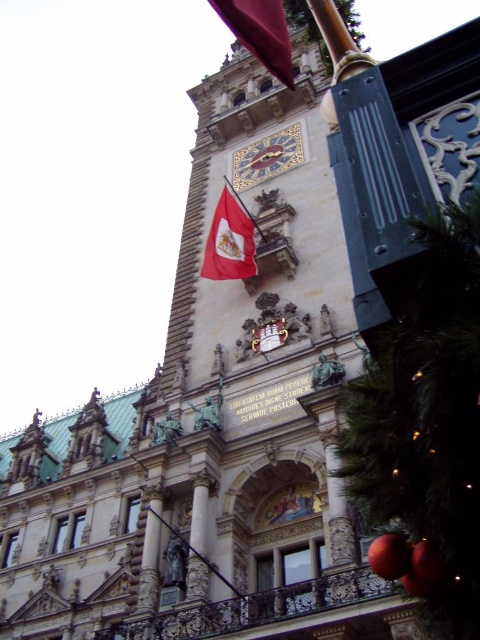
Does point (241, 237) come closer to viewer compared to point (241, 176)?

Yes, point (241, 237) is in front of point (241, 176).

Is red fabric flag at center bigger than gold mosaic clock at center?

Indeed, red fabric flag at center has a larger size compared to gold mosaic clock at center.

Is point (224, 205) farther from camera compared to point (278, 150)?

No.

The image size is (480, 640). Identify the location of red fabric flag at center. (229, 241).

Locate an element on the screen. The height and width of the screenshot is (640, 480). matte red flag at upper center is located at coordinates (261, 33).

Which of these two, matte red flag at upper center or red fabric flag at center, stands taller?

matte red flag at upper center

The height and width of the screenshot is (640, 480). I want to click on matte red flag at upper center, so click(x=261, y=33).

Does matte red flag at upper center appear under gold mosaic clock at center?

No.

Between point (273, 33) and point (275, 152), which one is positioned behind?

Positioned behind is point (275, 152).

Locate an element on the screen. matte red flag at upper center is located at coordinates (261, 33).